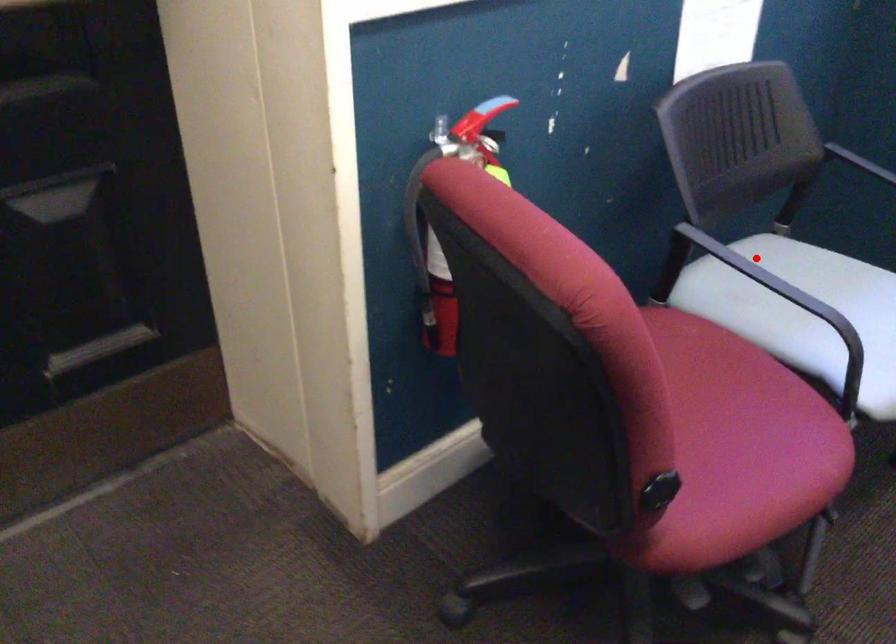
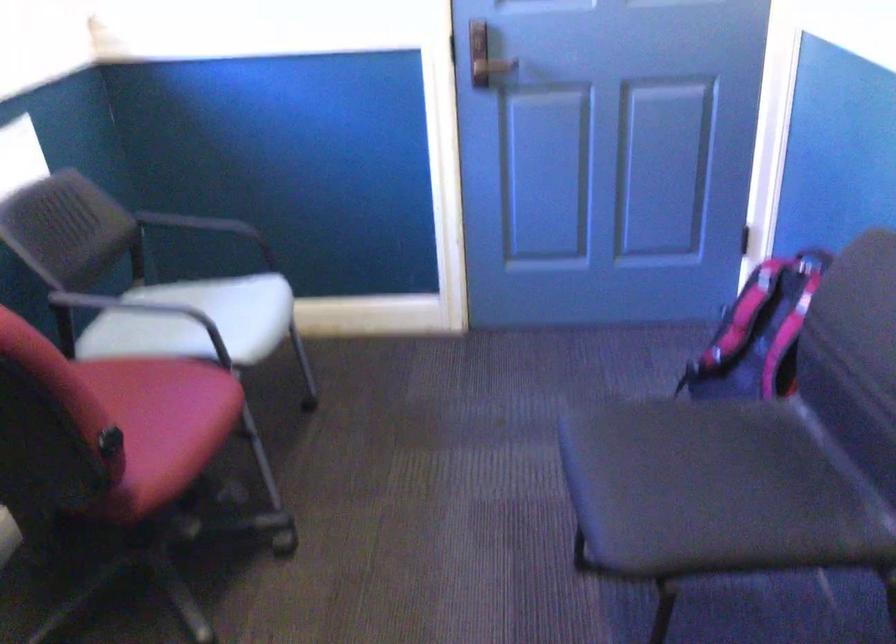
Where in the second image is the point corresponding to the highlighted location from the first image?

(135, 306)